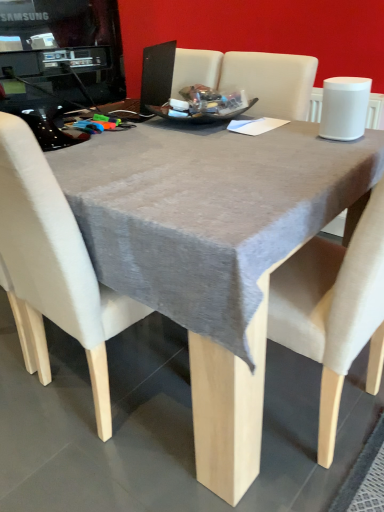
Question: From the image's perspective, is beige fabric chair at center above or below gray fabric table at center?

Choices:
 (A) below
 (B) above

Answer: (A)

Question: Visually, is beige fabric chair at center positioned to the left or to the right of gray fabric table at center?

Choices:
 (A) left
 (B) right

Answer: (A)

Question: Which is nearer to the black glossy desktop computer at upper left?

Choices:
 (A) beige fabric chair at center
 (B) gray fabric table at center

Answer: (A)

Question: Estimate the real-world distances between objects in this image. Which object is closer to the beige fabric chair at center?

Choices:
 (A) gray fabric table at center
 (B) black glossy desktop computer at upper left

Answer: (A)